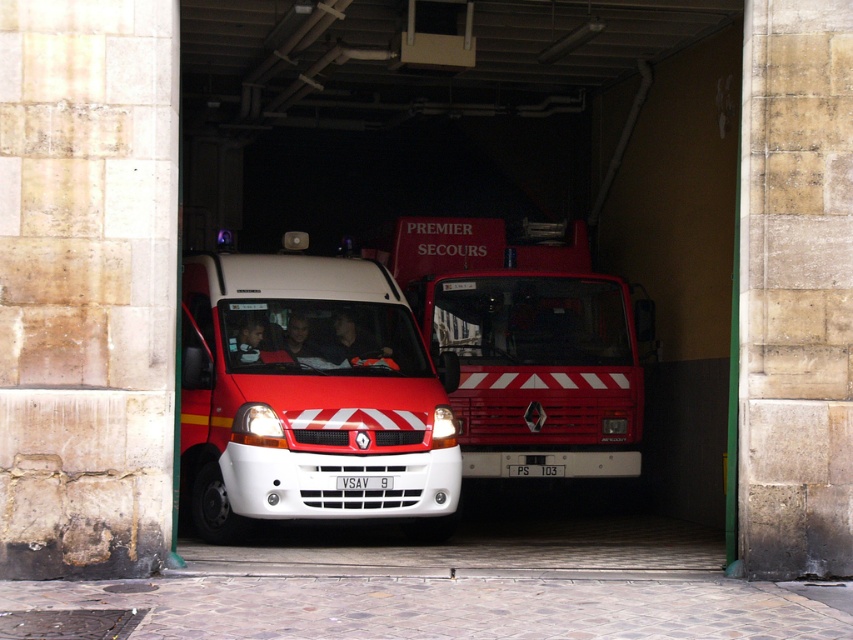
Does white matte van at center appear over red matte fire truck at center?

No.

Between white matte van at center and red matte fire truck at center, which one appears on the left side from the viewer's perspective?

white matte van at center

Measure the distance between point (398, 496) and camera.

Point (398, 496) is 11.15 meters from camera.

Image resolution: width=853 pixels, height=640 pixels. I want to click on white matte van at center, so click(309, 397).